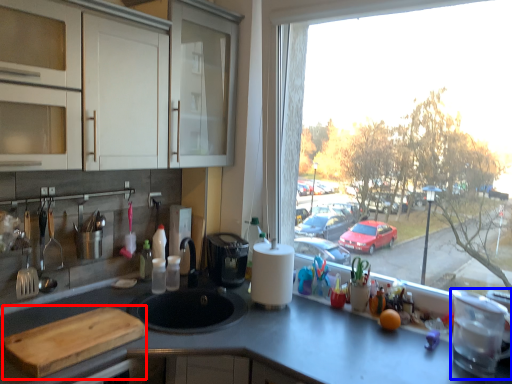
Question: Among these objects, which one is nearest to the camera, cutting board (highlighted by a red box) or appliance (highlighted by a blue box)?

Choices:
 (A) cutting board
 (B) appliance

Answer: (A)